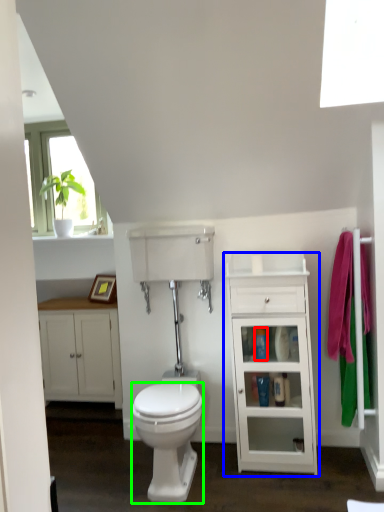
Question: Considering the real-world distances, which object is closest to toiletry (highlighted by a red box)? cabinetry (highlighted by a blue box) or bidet (highlighted by a green box).

Choices:
 (A) cabinetry
 (B) bidet

Answer: (A)